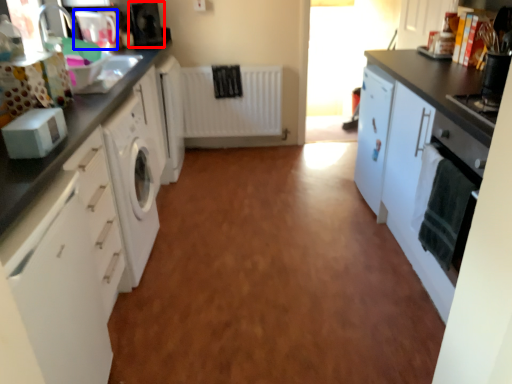
Question: Which of the following is the farthest to the observer, appliance (highlighted by a red box) or appliance (highlighted by a blue box)?

Choices:
 (A) appliance
 (B) appliance

Answer: (A)